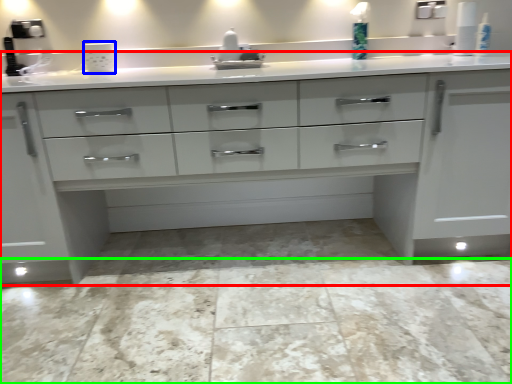
Question: Estimate the real-world distances between objects in this image. Which object is closer to chest of drawers (highlighted by a red box), appliance (highlighted by a blue box) or granite (highlighted by a green box)?

Choices:
 (A) appliance
 (B) granite

Answer: (B)